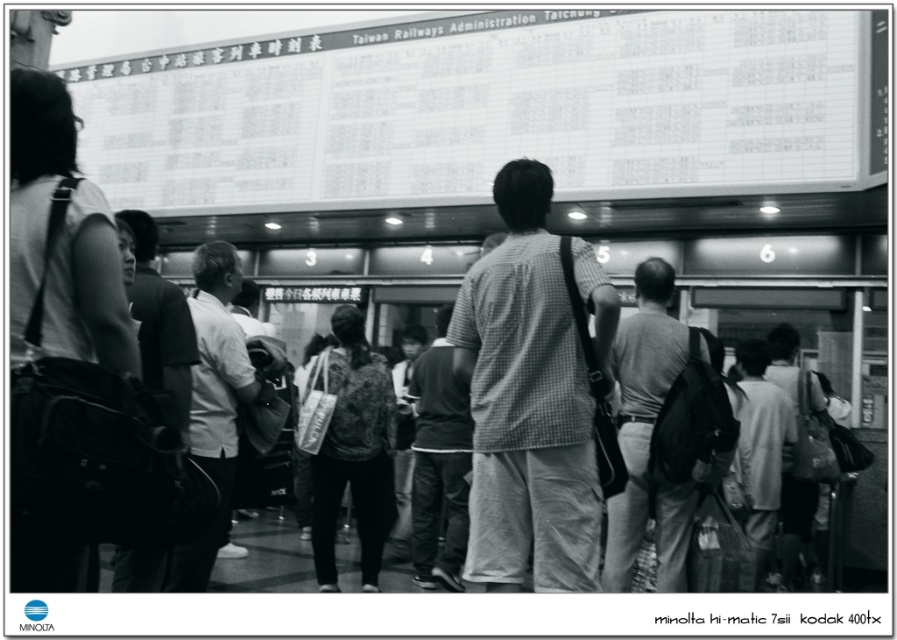
You are a photographer standing at the train station and want to capture both the checkered fabric shirt at center and the gray cotton shirt at center in a single photo. The minimum distance between the shirts is 3.66 feet. If your camera has a lens that can focus on objects as close as 3 feet apart, will you be able to capture both shirts clearly in the photo?

The checkered fabric shirt at center is 3.66 feet from the gray cotton shirt at center. Since the minimum focusing distance of the camera lens is 3 feet, which is less than the 3.66 feet between them, the camera can capture both shirts clearly in the photo.

You are a photographer standing at the train station and notice two people in the foreground wearing a white fabric shirt at center and dark gray textured pants at center. Which clothing item is shorter in length?

The white fabric shirt at center is shorter than dark gray textured pants at center.

You are standing at the point marked as point (512, 516) in the train station. You want to take a clear photo of the large digital display board showing train schedules. Considering the distance between you and the camera, will you be able to capture the entire display board in your photo?

The distance between point (512, 516) and the camera is 3.93 meters. Since the camera is positioned to capture the entire display board, you should be able to take a clear photo of the large digital display board from that distance.